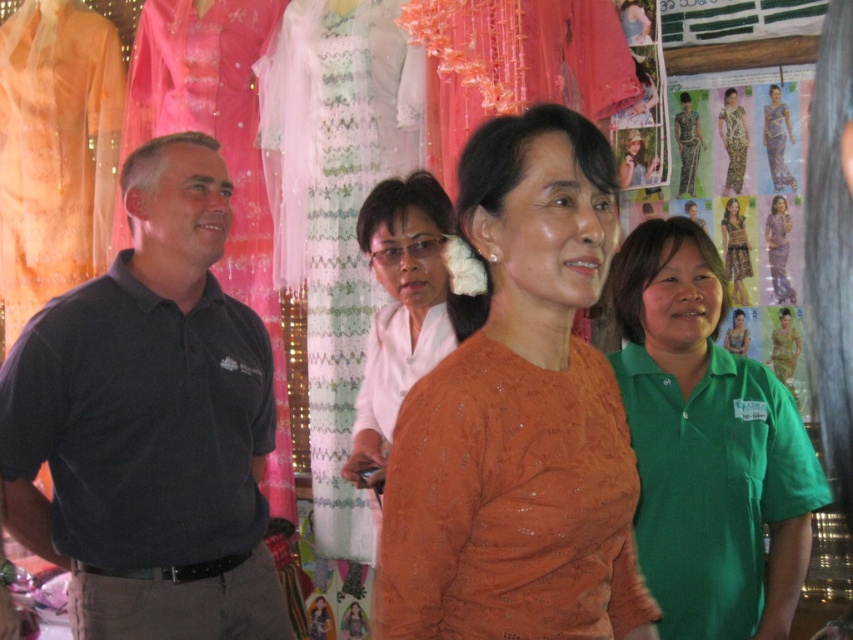
Question: Which point is closer to the camera taking this photo?

Choices:
 (A) 471,330
 (B) 624,477
 (C) 91,564

Answer: (B)

Question: Which of the following is the closest to the observer?

Choices:
 (A) (724, 225)
 (B) (380, 390)

Answer: (B)

Question: Among these points, which one is nearest to the camera?

Choices:
 (A) (138, 387)
 (B) (788, 301)

Answer: (A)

Question: Does dark blue polo shirt at left have a lesser width compared to matte orange dress at center?

Choices:
 (A) yes
 (B) no

Answer: (B)

Question: Is matte white shirt at center closer to the viewer compared to matte orange dress at center?

Choices:
 (A) yes
 (B) no

Answer: (A)

Question: Is orange textured blouse at center wider than matte white shirt at center?

Choices:
 (A) yes
 (B) no

Answer: (A)